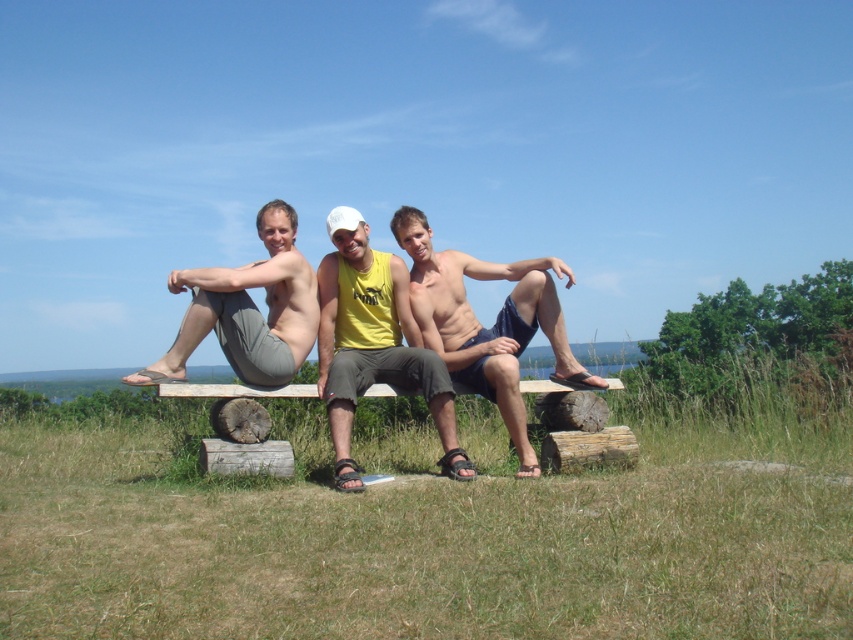
Does point (354, 387) lie behind point (474, 342)?

No, it is in front of (474, 342).

Is yellow matte tank top at center positioned before matte blue shorts at center?

Yes.

Which is in front, point (335, 314) or point (485, 280)?

Point (335, 314) is in front.

This screenshot has width=853, height=640. I want to click on yellow matte tank top at center, so click(x=373, y=342).

Is matte blue shorts at center bigger than matte gray pants at center?

Yes, matte blue shorts at center is bigger than matte gray pants at center.

Between matte blue shorts at center and matte gray pants at center, which one has more height?

matte blue shorts at center

The height and width of the screenshot is (640, 853). Find the location of `matte blue shorts at center`. matte blue shorts at center is located at coordinates (489, 326).

Where is `matte blue shorts at center`? Image resolution: width=853 pixels, height=640 pixels. matte blue shorts at center is located at coordinates [489, 326].

Is yellow matte tank top at center to the right of matte gray pants at center from the viewer's perspective?

Yes, yellow matte tank top at center is to the right of matte gray pants at center.

Consider the image. How far apart are yellow matte tank top at center and matte gray pants at center?

yellow matte tank top at center is 23.70 inches from matte gray pants at center.

I want to click on yellow matte tank top at center, so click(x=373, y=342).

You are a GUI agent. You are given a task and a screenshot of the screen. Output one action in this format:
    pyautogui.click(x=<x>, y=<y>)
    Task: Click on the yellow matte tank top at center
    This screenshot has height=640, width=853.
    Given the screenshot: What is the action you would take?
    pyautogui.click(x=373, y=342)